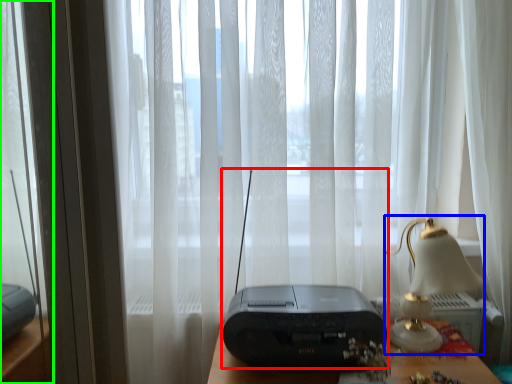
Question: Estimate the real-world distances between objects in this image. Which object is farther from gadget (highlighted by a red box), table lamp (highlighted by a blue box) or glass door (highlighted by a green box)?

Choices:
 (A) table lamp
 (B) glass door

Answer: (B)